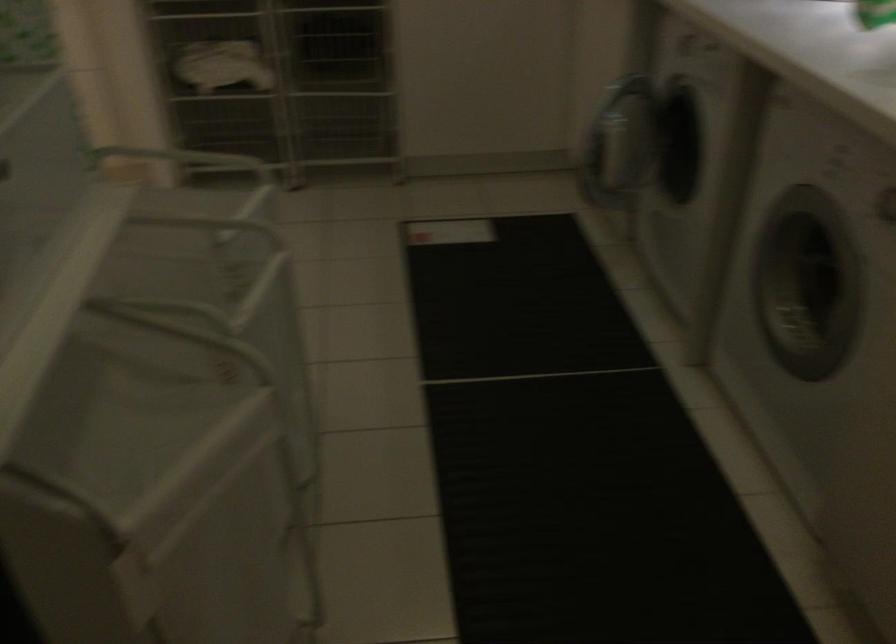
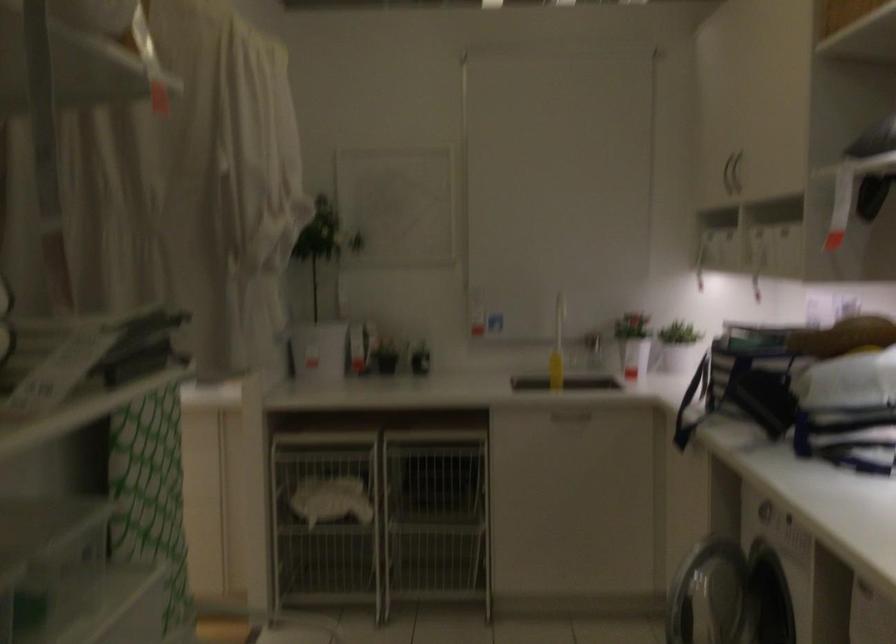
Question: The images are taken continuously from a first-person perspective. In which direction are you moving?

Choices:
 (A) Left
 (B) Right
 (C) Forward
 (D) Backward

Answer: (D)